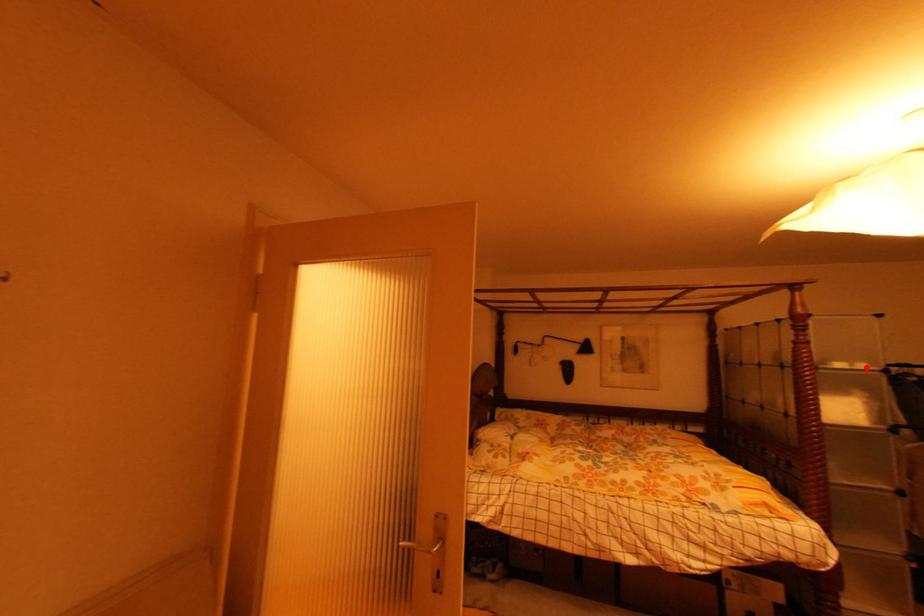
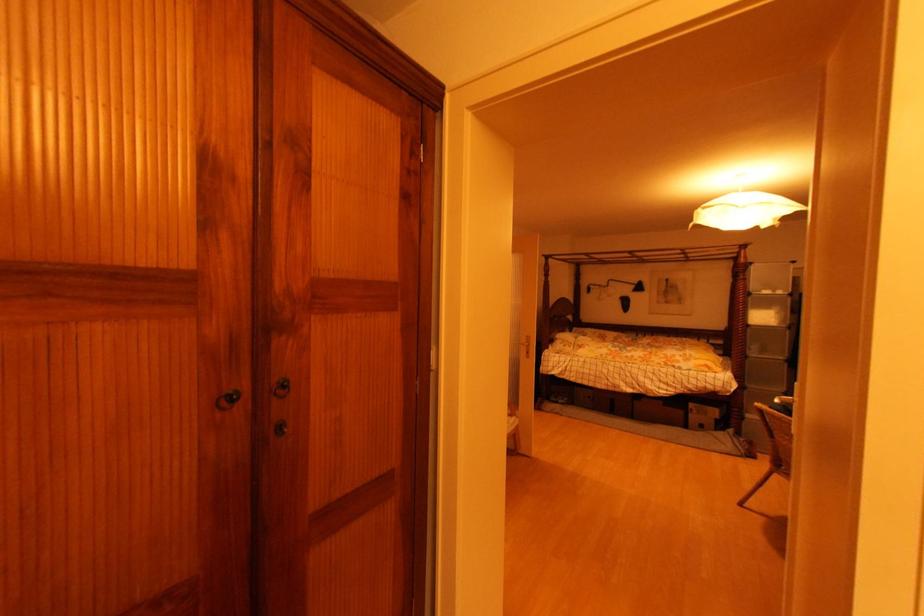
Question: I am providing you with two images of the same scene from different viewpoints. A red point is marked on the first image. Can you still see the location of the red point in image 2?

Choices:
 (A) Yes
 (B) No

Answer: (A)